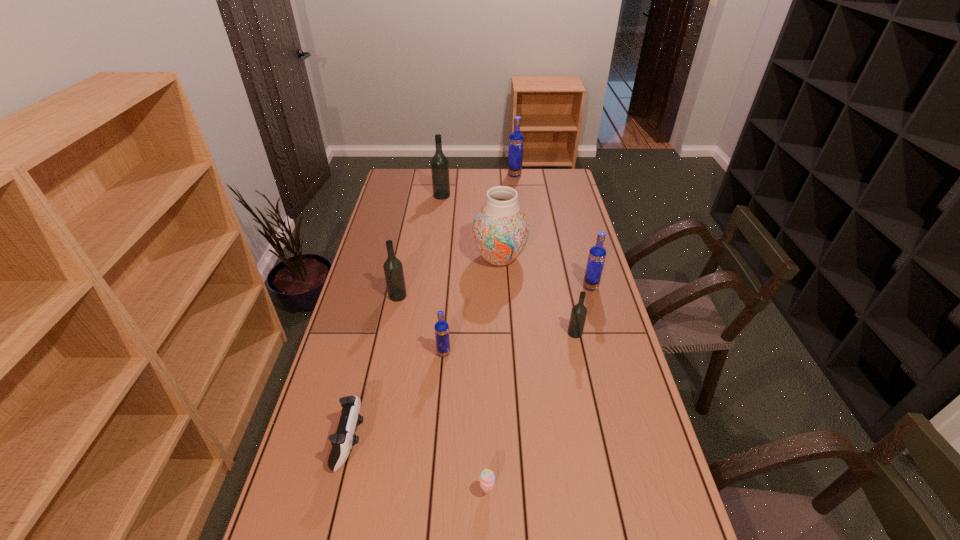
Locate an element on the screen. The height and width of the screenshot is (540, 960). the fourth vodka from left to right is located at coordinates (516, 139).

Where is `the farthest object`? This screenshot has height=540, width=960. the farthest object is located at coordinates (516, 139).

Find the location of `the second vodka from left to right`. the second vodka from left to right is located at coordinates (439, 164).

The image size is (960, 540). What are the coordinates of `the second farthest object` in the screenshot? It's located at (439, 164).

Locate an element on the screen. The width and height of the screenshot is (960, 540). vase is located at coordinates (500, 230).

The height and width of the screenshot is (540, 960). What are the coordinates of `the second nearest blue vodka` in the screenshot? It's located at (597, 254).

Locate an element on the screen. the rightmost vodka is located at coordinates (597, 254).

Identify the location of the second biggest black vodka. This screenshot has width=960, height=540. (393, 269).

Locate an element on the screen. Image resolution: width=960 pixels, height=540 pixels. the second nearest black vodka is located at coordinates (393, 269).

Where is `the fourth vodka from right to left`? The image size is (960, 540). the fourth vodka from right to left is located at coordinates (441, 327).